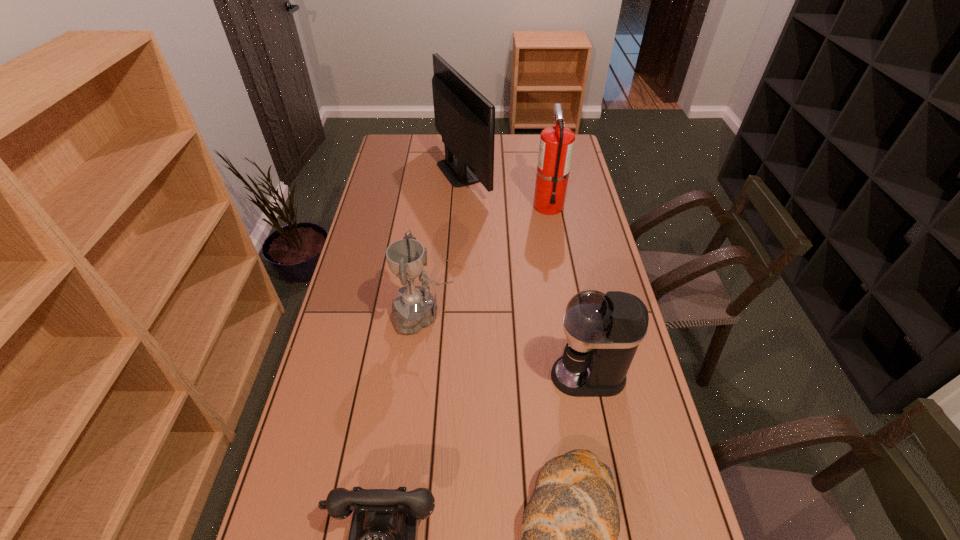
Where is `computer monitor`? Image resolution: width=960 pixels, height=540 pixels. computer monitor is located at coordinates (465, 119).

Locate an element on the screen. fire extinguisher is located at coordinates (556, 146).

Find the location of `the fourth farthest object`. the fourth farthest object is located at coordinates (603, 331).

The image size is (960, 540). Identify the location of the fourth nearest object. (415, 307).

At what (x,y) coordinates should I click in order to perform the action: click on vacant space located 0.350m on the front-facing side of the computer monitor. Please return your answer as a coordinate pair (x, y). The image size is (960, 540). Looking at the image, I should click on (569, 171).

I want to click on vacant region located at the nozzle of the fire extinguisher, so click(553, 229).

The image size is (960, 540). I want to click on vacant region located 0.250m place cup under the spout of the third nearest object, so coord(463,376).

The image size is (960, 540). I want to click on vacant space located 0.130m place cup under the spout of the third nearest object, so click(505, 376).

You are a GUI agent. You are given a task and a screenshot of the screen. Output one action in this format:
    pyautogui.click(x=<x>, y=<y>)
    Task: Click on the free space located 0.080m place cup under the spout of the third nearest object
    Image resolution: width=960 pixels, height=540 pixels.
    Given the screenshot: What is the action you would take?
    pyautogui.click(x=523, y=376)

At what (x,y) coordinates should I click in order to perform the action: click on free space located on the side with emblem of the award. Please return your answer as a coordinate pair (x, y). The width and height of the screenshot is (960, 540). Looking at the image, I should click on (516, 315).